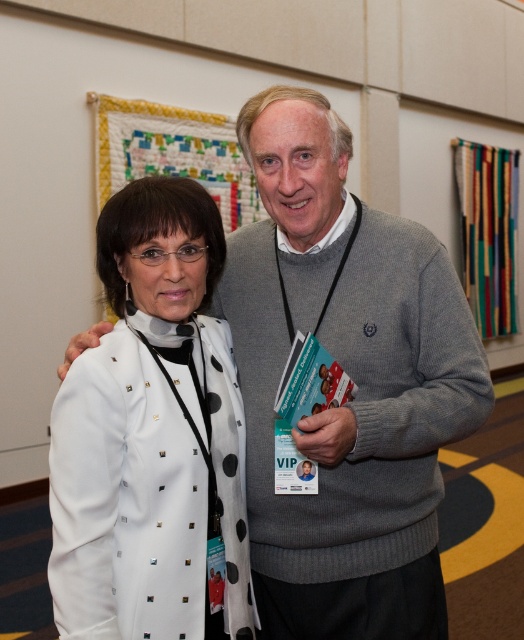
The image size is (524, 640). What do you see at coordinates (352, 378) in the screenshot?
I see `white textured coat at center` at bounding box center [352, 378].

You are a GUI agent. You are given a task and a screenshot of the screen. Output one action in this format:
    pyautogui.click(x=<x>, y=<y>)
    Task: Click on the white textured coat at center
    This screenshot has width=524, height=640.
    Given the screenshot: What is the action you would take?
    pyautogui.click(x=352, y=378)

You are a GUI agent. You are given a task and a screenshot of the screen. Output one action in this format:
    pyautogui.click(x=<x>, y=<y>)
    Task: Click on the white textured coat at center
    
    Given the screenshot: What is the action you would take?
    pyautogui.click(x=352, y=378)

Is white textured coat at center smaller than teal paper booklet at center?

Actually, white textured coat at center might be larger than teal paper booklet at center.

I want to click on white textured coat at center, so click(352, 378).

Where is `white textured coat at center`? This screenshot has height=640, width=524. white textured coat at center is located at coordinates (352, 378).

Who is positioned more to the left, white studded coat at left or teal paper booklet at center?

white studded coat at left is more to the left.

Is point (111, 353) more distant than point (345, 380)?

No, (111, 353) is closer to viewer.

You are a GUI agent. You are given a task and a screenshot of the screen. Output one action in this format:
    pyautogui.click(x=<x>, y=<y>)
    Task: Click on the white studded coat at left
    
    Given the screenshot: What is the action you would take?
    pyautogui.click(x=151, y=435)